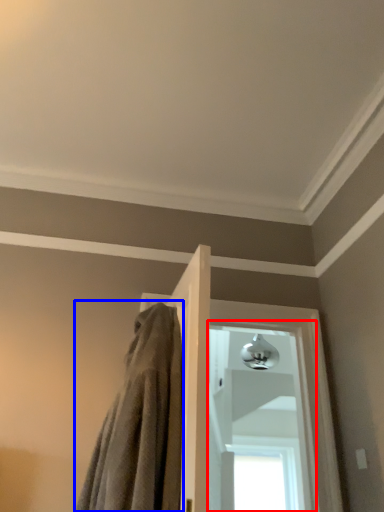
Question: Which of the following is the farthest to the observer, window (highlighted by a red box) or bath towel (highlighted by a blue box)?

Choices:
 (A) window
 (B) bath towel

Answer: (A)